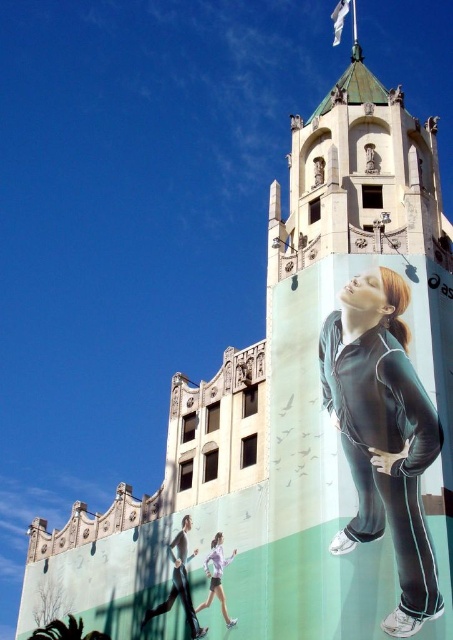
Which is in front, point (399, 627) or point (187, 561)?

Point (399, 627)

The width and height of the screenshot is (453, 640). What do you see at coordinates (384, 435) in the screenshot?
I see `matte black tracksuit at right` at bounding box center [384, 435].

This screenshot has width=453, height=640. What are the coordinates of `matte black tracksuit at right` in the screenshot? It's located at (384, 435).

The image size is (453, 640). What are the coordinates of `matte black tracksuit at right` in the screenshot? It's located at (384, 435).

Is matte black tracksuit at right shorter than light purple fabric at lower center?

Incorrect, matte black tracksuit at right's height does not fall short of light purple fabric at lower center's.

Looking at this image, is matte black tracksuit at right positioned in front of light purple fabric at lower center?

That is True.

In the scene shown: Who is more distant from viewer, (417, 481) or (197, 605)?

The point (197, 605) is more distant.

This screenshot has height=640, width=453. Find the location of `matte black tracksuit at right`. matte black tracksuit at right is located at coordinates (384, 435).

Who is positioned more to the right, black fabric pants at lower left or light purple fabric at lower center?

light purple fabric at lower center is more to the right.

Can you confirm if black fabric pants at lower left is shorter than light purple fabric at lower center?

Incorrect, black fabric pants at lower left's height does not fall short of light purple fabric at lower center's.

Which is in front, point (191, 554) or point (212, 545)?

Positioned in front is point (212, 545).

Find the location of a particular element. The height and width of the screenshot is (640, 453). black fabric pants at lower left is located at coordinates (178, 582).